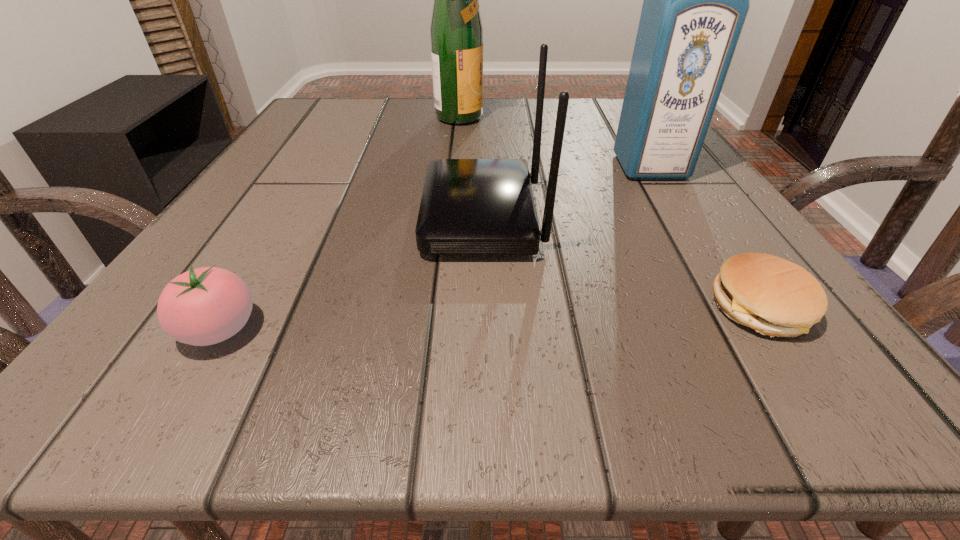
Identify the location of free point that satisfies the following two spatial constraints: 1. on the flat label side of the right liquor; 2. on the left side of the patty. (737, 308).